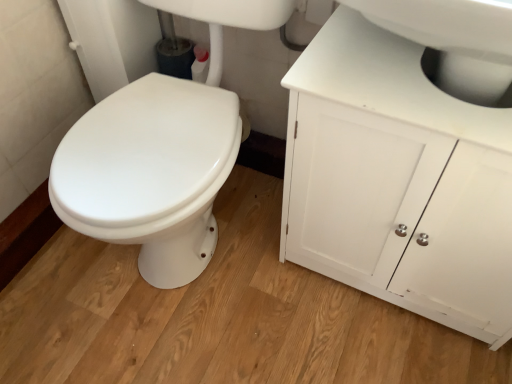
Question: Can you confirm if white matte cabinet at upper right is wider than white glossy sink at upper right?

Choices:
 (A) no
 (B) yes

Answer: (A)

Question: Is white matte cabinet at upper right positioned with its back to white glossy sink at upper right?

Choices:
 (A) yes
 (B) no

Answer: (B)

Question: Considering the relative sizes of white matte cabinet at upper right and white glossy sink at upper right in the image provided, is white matte cabinet at upper right smaller than white glossy sink at upper right?

Choices:
 (A) yes
 (B) no

Answer: (B)

Question: From a real-world perspective, is white matte cabinet at upper right on top of white glossy sink at upper right?

Choices:
 (A) yes
 (B) no

Answer: (B)

Question: Considering the relative positions of white matte cabinet at upper right and white glossy sink at upper right in the image provided, is white matte cabinet at upper right to the left of white glossy sink at upper right from the viewer's perspective?

Choices:
 (A) no
 (B) yes

Answer: (A)

Question: From the image's perspective, does white matte cabinet at upper right appear higher than white glossy sink at upper right?

Choices:
 (A) no
 (B) yes

Answer: (A)

Question: Considering the relative sizes of white glossy sink at upper right and white matte cabinet at upper right in the image provided, is white glossy sink at upper right thinner than white matte cabinet at upper right?

Choices:
 (A) yes
 (B) no

Answer: (B)

Question: From the image's perspective, would you say white glossy sink at upper right is shown under white matte cabinet at upper right?

Choices:
 (A) no
 (B) yes

Answer: (A)

Question: From a real-world perspective, is white glossy sink at upper right beneath white matte cabinet at upper right?

Choices:
 (A) no
 (B) yes

Answer: (A)

Question: Could you tell me if white glossy sink at upper right is turned towards white matte cabinet at upper right?

Choices:
 (A) no
 (B) yes

Answer: (A)

Question: Does white glossy sink at upper right appear on the right side of white matte cabinet at upper right?

Choices:
 (A) yes
 (B) no

Answer: (B)

Question: Can we say white glossy sink at upper right lies outside white matte cabinet at upper right?

Choices:
 (A) yes
 (B) no

Answer: (A)

Question: In the image, is white glossy sink at upper right on the left side or the right side of white matte cabinet at upper right?

Choices:
 (A) right
 (B) left

Answer: (B)